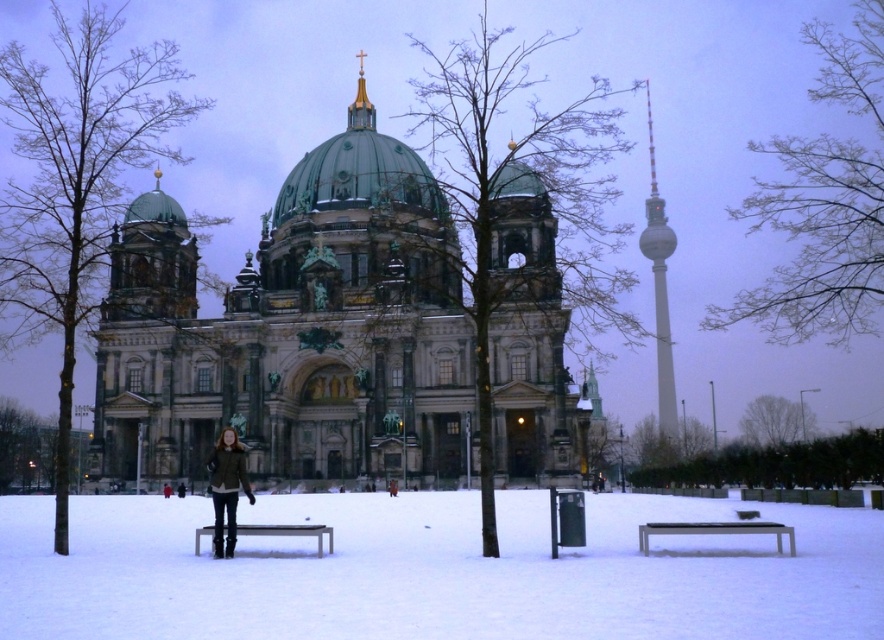
Question: Considering the real-world distances, which object is closest to the brown leather jacket at center?

Choices:
 (A) metallic silver bench at lower right
 (B) white matte snow at center

Answer: (B)

Question: Is the position of green stone church at center less distant than that of metallic silver bench at lower right?

Choices:
 (A) yes
 (B) no

Answer: (B)

Question: Which of the following is the farthest from the observer?

Choices:
 (A) (42, 506)
 (B) (235, 502)
 (C) (271, 525)

Answer: (A)

Question: Which point is closer to the camera taking this photo?

Choices:
 (A) (221, 552)
 (B) (667, 316)
 (C) (588, 528)

Answer: (A)

Question: Does white matte snow at center appear on the left side of brown leather jacket at center?

Choices:
 (A) yes
 (B) no

Answer: (B)

Question: Is green stone church at center closer to camera compared to white matte snow at center?

Choices:
 (A) yes
 (B) no

Answer: (B)